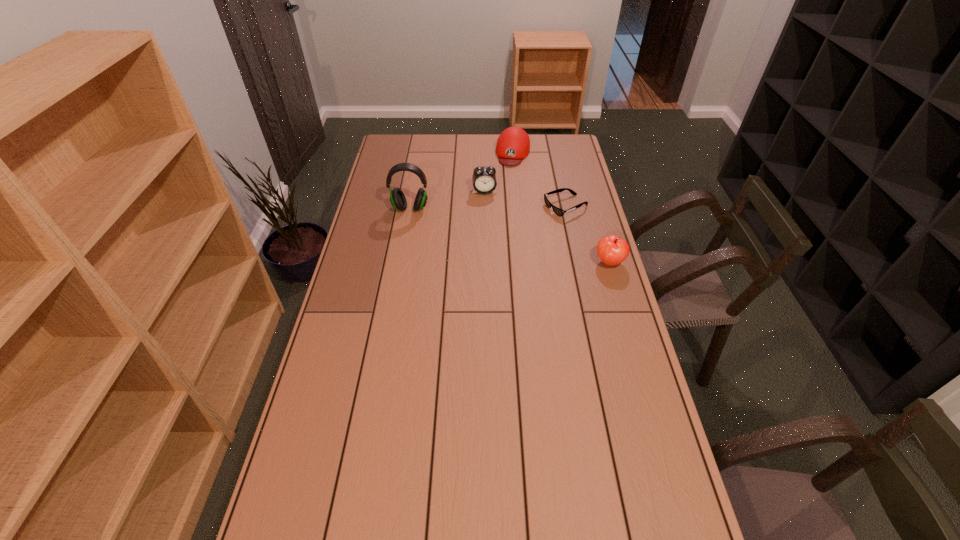
This screenshot has height=540, width=960. What are the coordinates of `the leftmost object` in the screenshot? It's located at (397, 198).

Image resolution: width=960 pixels, height=540 pixels. I want to click on headset, so click(397, 198).

You are a GUI agent. You are given a task and a screenshot of the screen. Output one action in this format:
    pyautogui.click(x=<x>, y=<y>)
    Task: Click on the nearest object
    
    Given the screenshot: What is the action you would take?
    pyautogui.click(x=612, y=250)

Locate an element on the screen. This screenshot has height=540, width=960. the shortest object is located at coordinates (557, 211).

This screenshot has height=540, width=960. Find the location of `the third object from left to right`. the third object from left to right is located at coordinates (513, 145).

At what (x,y) coordinates should I click in order to perform the action: click on baseball cap. Please return your answer as a coordinate pair (x, y). The image size is (960, 540). Looking at the image, I should click on (513, 145).

The height and width of the screenshot is (540, 960). Find the location of `alarm clock`. alarm clock is located at coordinates (484, 179).

Find the location of a particular element. vacant area situated 0.070m on the ear cups of the leftmost object is located at coordinates (407, 227).

This screenshot has height=540, width=960. What are the coordinates of `vacant space located 0.050m on the front of the apple` in the screenshot? It's located at (615, 284).

Find the location of a particular element. The width and height of the screenshot is (960, 540). free space located on the front-facing side of the sunglasses is located at coordinates (516, 226).